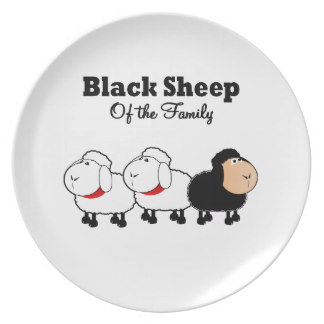
Where is `plates edge`? Image resolution: width=324 pixels, height=324 pixels. plates edge is located at coordinates (286, 243), (300, 210), (305, 128).